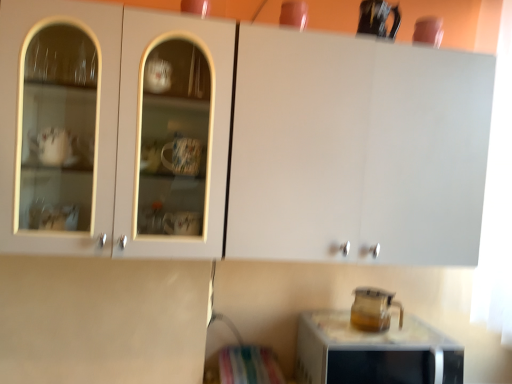
Question: Can you confirm if transparent glass pitcher at lower right is taller than transparent glass pitcher at lower right?

Choices:
 (A) yes
 (B) no

Answer: (B)

Question: Considering the relative sizes of transparent glass pitcher at lower right and transparent glass pitcher at lower right in the image provided, is transparent glass pitcher at lower right wider than transparent glass pitcher at lower right?

Choices:
 (A) no
 (B) yes

Answer: (A)

Question: Considering the relative sizes of transparent glass pitcher at lower right and transparent glass pitcher at lower right in the image provided, is transparent glass pitcher at lower right smaller than transparent glass pitcher at lower right?

Choices:
 (A) yes
 (B) no

Answer: (A)

Question: From the image's perspective, is transparent glass pitcher at lower right located above transparent glass pitcher at lower right?

Choices:
 (A) yes
 (B) no

Answer: (A)

Question: Does transparent glass pitcher at lower right touch transparent glass pitcher at lower right?

Choices:
 (A) yes
 (B) no

Answer: (B)

Question: Considering the positions of matte white cabinet at upper center and transparent glass pitcher at lower right in the image, is matte white cabinet at upper center bigger or smaller than transparent glass pitcher at lower right?

Choices:
 (A) small
 (B) big

Answer: (B)

Question: Visually, is matte white cabinet at upper center positioned to the left or to the right of transparent glass pitcher at lower right?

Choices:
 (A) right
 (B) left

Answer: (B)

Question: From a real-world perspective, is matte white cabinet at upper center above or below transparent glass pitcher at lower right?

Choices:
 (A) below
 (B) above

Answer: (B)

Question: Considering the positions of point (280, 188) and point (373, 307), is point (280, 188) closer or farther from the camera than point (373, 307)?

Choices:
 (A) closer
 (B) farther

Answer: (A)

Question: From a real-world perspective, relative to transparent glass pitcher at lower right, is transparent glass pitcher at lower right vertically above or below?

Choices:
 (A) below
 (B) above

Answer: (B)

Question: Is transparent glass pitcher at lower right taller or shorter than transparent glass pitcher at lower right?

Choices:
 (A) tall
 (B) short

Answer: (B)

Question: Based on their sizes in the image, would you say transparent glass pitcher at lower right is bigger or smaller than transparent glass pitcher at lower right?

Choices:
 (A) small
 (B) big

Answer: (A)

Question: Based on their positions, is transparent glass pitcher at lower right located to the left or right of transparent glass pitcher at lower right?

Choices:
 (A) left
 (B) right

Answer: (A)

Question: Choose the correct answer: Is matte white cabinet at upper center inside transparent glass pitcher at lower right or outside it?

Choices:
 (A) outside
 (B) inside

Answer: (A)

Question: Looking at the image, does matte white cabinet at upper center seem bigger or smaller compared to transparent glass pitcher at lower right?

Choices:
 (A) big
 (B) small

Answer: (A)